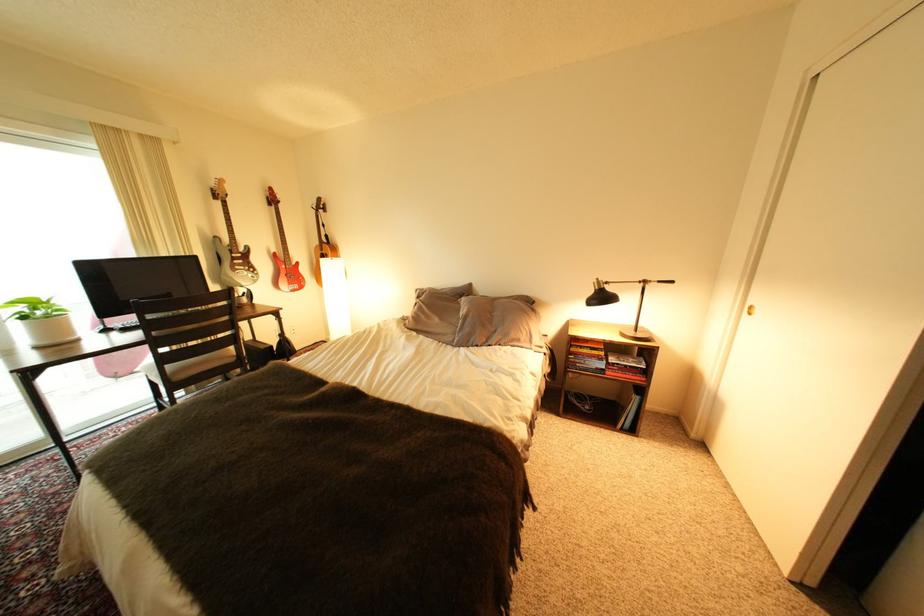
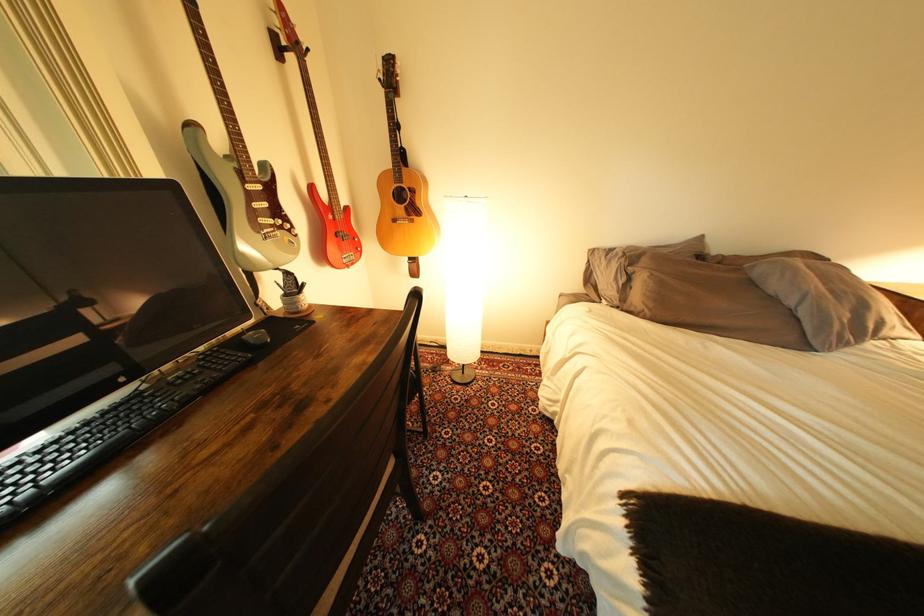
Where in the second image is the point corresponding to point 429,292 from the first image?

(604, 253)